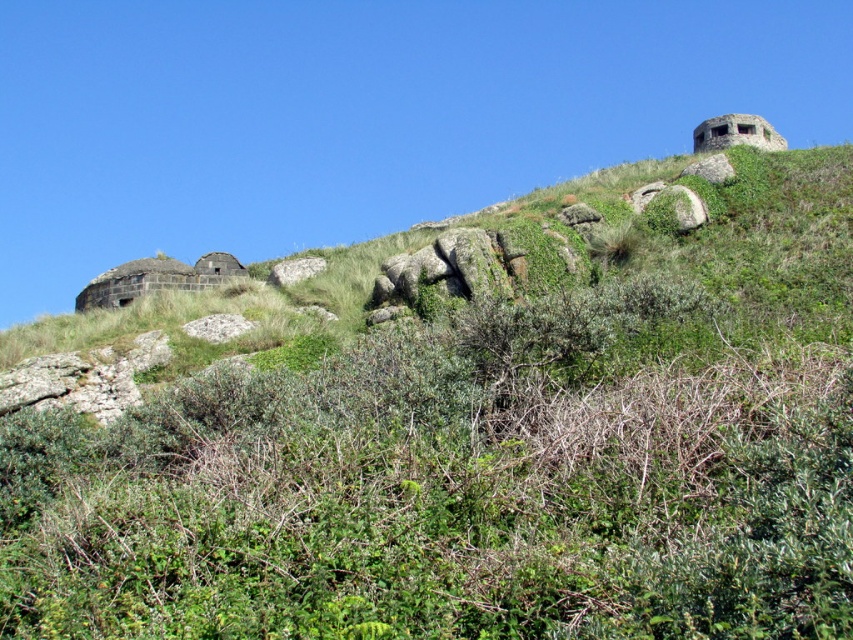
Question: Is the position of rustic stone fort at upper left less distant than that of brick-like concrete fort at upper right?

Choices:
 (A) no
 (B) yes

Answer: (A)

Question: Which object is closer to the camera taking this photo?

Choices:
 (A) rustic stone fort at upper left
 (B) green leafy shrubs at upper center

Answer: (B)

Question: Can you confirm if green leafy shrubs at upper center is thinner than rustic stone fort at upper left?

Choices:
 (A) no
 (B) yes

Answer: (A)

Question: Based on their relative distances, which object is farther from the brick-like concrete fort at upper right?

Choices:
 (A) rustic stone fort at upper left
 (B) green leafy shrubs at upper center

Answer: (A)

Question: Which point appears farthest from the camera in this image?

Choices:
 (A) (225, 257)
 (B) (697, 472)

Answer: (A)

Question: Can you confirm if green leafy shrubs at upper center is positioned below brick-like concrete fort at upper right?

Choices:
 (A) yes
 (B) no

Answer: (A)